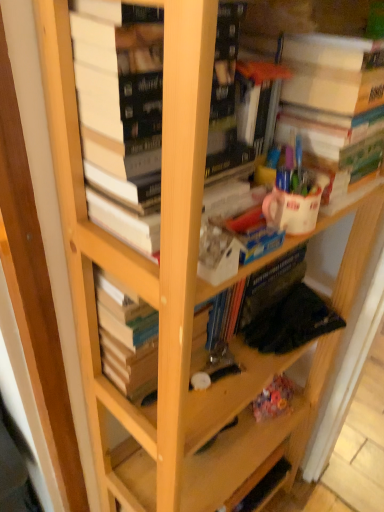
At what (x,y) coordinates should I click in order to perform the action: click on blank space situated above white matte paper at upper right, marked as the third book in a left-to-right arrangement (from a real-world perspective). Please return your answer as a coordinate pair (x, y). Image resolution: width=384 pixels, height=512 pixels. Looking at the image, I should click on (339, 23).